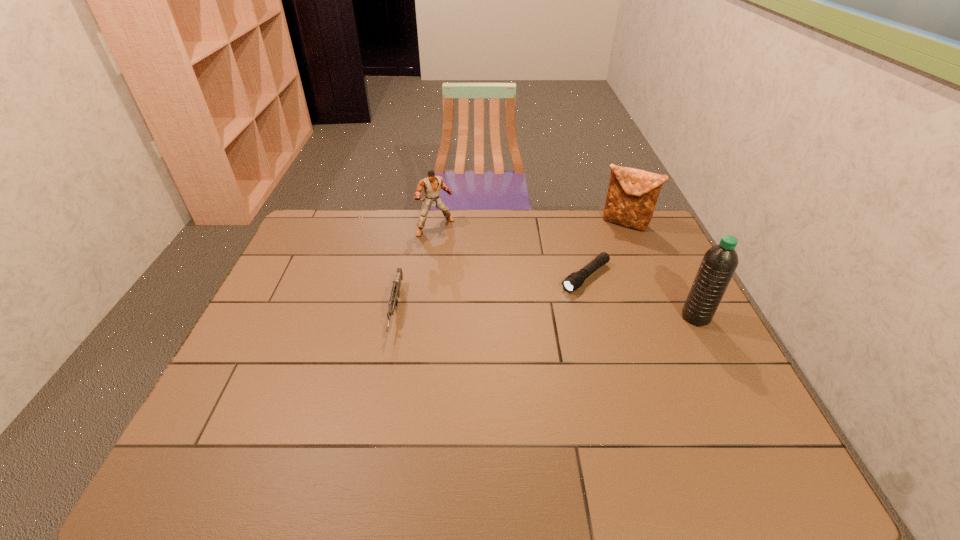
Locate an element on the screen. The height and width of the screenshot is (540, 960). water bottle that is positioned at the right edge is located at coordinates (719, 263).

I want to click on clutch bag that is at the right edge, so click(632, 195).

Find the location of a particular element. This screenshot has height=540, width=960. object that is at the far right corner is located at coordinates click(632, 195).

In the image, there is a desktop. Identify the location of vacant space at the far edge. The width and height of the screenshot is (960, 540). (543, 221).

Where is `vacant space at the left edge`? The image size is (960, 540). vacant space at the left edge is located at coordinates (310, 260).

In the image, there is a desktop. What are the coordinates of `vacant area at the right edge` in the screenshot? It's located at (694, 346).

Where is `blank space at the near left corner of the desktop`? The height and width of the screenshot is (540, 960). blank space at the near left corner of the desktop is located at coordinates (269, 417).

Locate an element on the screen. vacant region between the second object from left to right and the flashlight is located at coordinates (511, 252).

Locate an element on the screen. vacant region between the water bottle and the clutch bag is located at coordinates (660, 270).

Where is `free space between the water bottle and the second object from left to right`? This screenshot has width=960, height=540. free space between the water bottle and the second object from left to right is located at coordinates (565, 272).